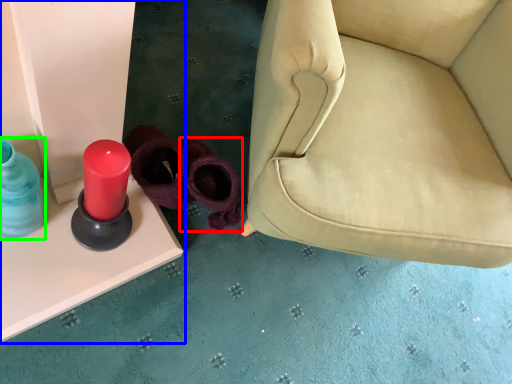
Question: Estimate the real-world distances between objects in this image. Which object is farther from footwear (highlighted by a red box), furniture (highlighted by a blue box) or bottle (highlighted by a green box)?

Choices:
 (A) furniture
 (B) bottle

Answer: (B)